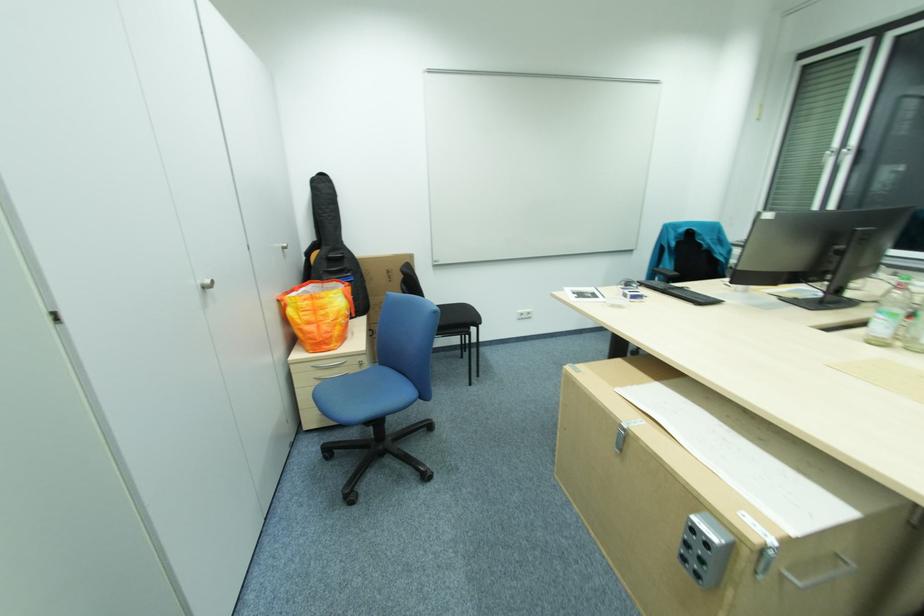
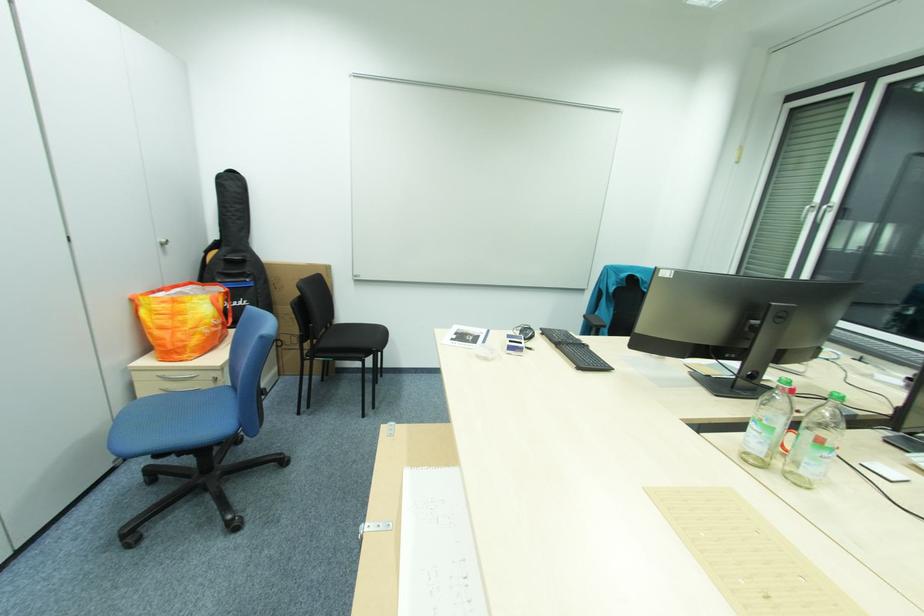
Question: Which direction would the cameraman need to move to produce the second image? Reply with the corresponding letter.

Choices:
 (A) Left
 (B) Right
 (C) Forward
 (D) Backward

Answer: (B)